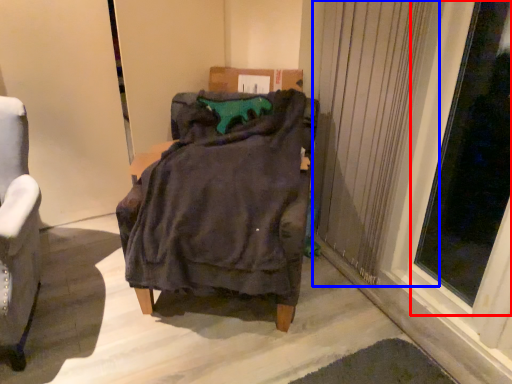
Question: Which of the following is the closest to the observer, window (highlighted by a red box) or curtain (highlighted by a blue box)?

Choices:
 (A) window
 (B) curtain

Answer: (A)